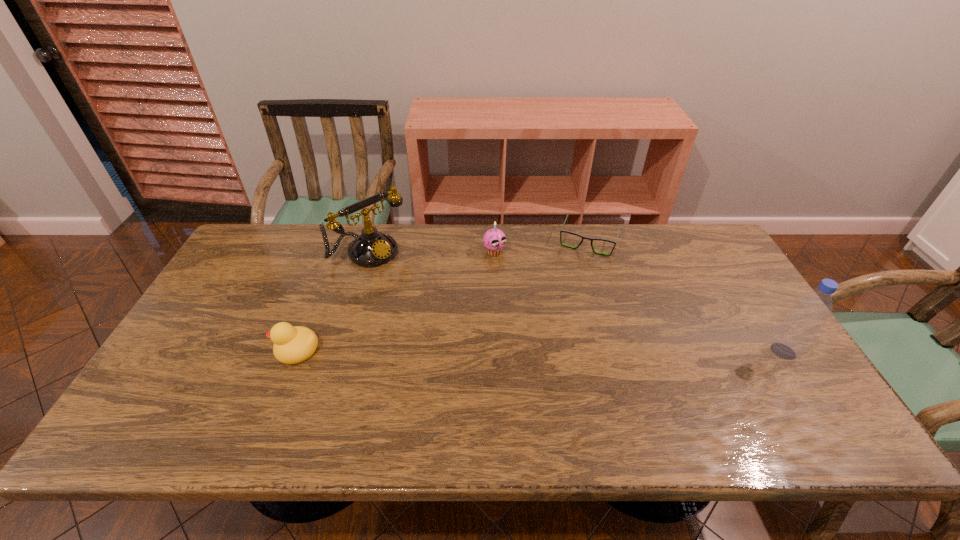
Identify which object is the second nearest to the third shortest object. Please provide its 2D coordinates. Your answer should be formatted as a tuple, i.e. [(x, y)], where the tuple contains the x and y coordinates of a point satisfying the conditions above.

[(372, 248)]

You are a GUI agent. You are given a task and a screenshot of the screen. Output one action in this format:
    pyautogui.click(x=<x>, y=<y>)
    Task: Click on the fourth closest object relative to the shortest object
    Image resolution: width=960 pixels, height=540 pixels.
    Given the screenshot: What is the action you would take?
    pyautogui.click(x=292, y=345)

You are a GUI agent. You are given a task and a screenshot of the screen. Output one action in this format:
    pyautogui.click(x=<x>, y=<y>)
    Task: Click on the free space that satisfies the following two spatial constraints: 1. on the back side of the shortest object; 2. on the left side of the third object from left to right
    Image resolution: width=960 pixels, height=540 pixels.
    Given the screenshot: What is the action you would take?
    pyautogui.click(x=494, y=241)

Identify the location of blank area in the image that satisfies the following two spatial constraints: 1. on the front side of the third shortest object; 2. on the left side of the bottle. This screenshot has width=960, height=540. (498, 351).